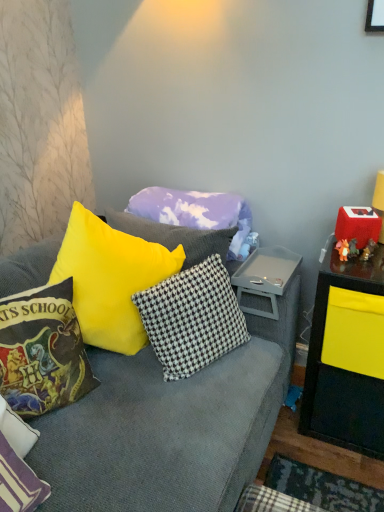
Find the location of `cloud-patterned fabric pillow at center, the 1th pillow from the back`. cloud-patterned fabric pillow at center, the 1th pillow from the back is located at coordinates (195, 211).

Is white and brown checkered pillow at center, the second pillow when ordered from back to front, bigger than white textured pillow at lower left, the 4th pillow when ordered from back to front?

Yes, white and brown checkered pillow at center, the second pillow when ordered from back to front, is bigger than white textured pillow at lower left, the 4th pillow when ordered from back to front.

Is white and brown checkered pillow at center, which is the 3th pillow in front-to-back order, far away from white textured pillow at lower left, which appears as the 1th pillow when viewed from the front?

No, white and brown checkered pillow at center, which is the 3th pillow in front-to-back order, is in close proximity to white textured pillow at lower left, which appears as the 1th pillow when viewed from the front.

In the image, is white and brown checkered pillow at center, the second pillow when ordered from back to front, positioned in front of or behind white textured pillow at lower left, which appears as the 1th pillow when viewed from the front?

white and brown checkered pillow at center, the second pillow when ordered from back to front, is behind white textured pillow at lower left, which appears as the 1th pillow when viewed from the front.

Which object is positioned more to the right, white and brown checkered pillow at center, the second pillow when ordered from back to front, or white textured pillow at lower left, the 4th pillow when ordered from back to front?

white and brown checkered pillow at center, the second pillow when ordered from back to front, is more to the right.

Is cloud-patterned fabric pillow at center, the 1th pillow from the back, turned away from white and brown checkered pillow at center, the second pillow when ordered from back to front?

No, cloud-patterned fabric pillow at center, the 1th pillow from the back, is not facing away from white and brown checkered pillow at center, the second pillow when ordered from back to front.

Between cloud-patterned fabric pillow at center, the 1th pillow from the back, and white and brown checkered pillow at center, the second pillow when ordered from back to front, which one has smaller width?

white and brown checkered pillow at center, the second pillow when ordered from back to front, is thinner.

Is gray plastic tray at center not within velvet harry potter-themed pillow at left, which is the 3th pillow from back to front?

gray plastic tray at center lies outside velvet harry potter-themed pillow at left, which is the 3th pillow from back to front,'s area.

From the image's perspective, which is below, gray plastic tray at center or velvet harry potter-themed pillow at left, which is the 3th pillow from back to front?

velvet harry potter-themed pillow at left, which is the 3th pillow from back to front, appears lower in the image.

From a real-world perspective, between gray plastic tray at center and velvet harry potter-themed pillow at left, which is the 3th pillow from back to front, who is vertically lower?

gray plastic tray at center, from a real-world perspective.

Considering the sizes of objects gray plastic tray at center and velvet harry potter-themed pillow at left, which is the 3th pillow from back to front, in the image provided, who is bigger, gray plastic tray at center or velvet harry potter-themed pillow at left, which is the 3th pillow from back to front,?

With larger size is velvet harry potter-themed pillow at left, which is the 3th pillow from back to front.

How much distance is there between velvet harry potter-themed pillow at left, which is the 3th pillow from back to front, and cloud-patterned fabric pillow at center, placed as the fourth pillow when sorted from front to back?

The distance of velvet harry potter-themed pillow at left, which is the 3th pillow from back to front, from cloud-patterned fabric pillow at center, placed as the fourth pillow when sorted from front to back, is 26.30 inches.

Does point (19, 339) come in front of point (172, 208)?

Yes.

How different are the orientations of velvet harry potter-themed pillow at left, which is the 3th pillow from back to front, and cloud-patterned fabric pillow at center, placed as the fourth pillow when sorted from front to back, in degrees?

61.4 degrees separate the facing orientations of velvet harry potter-themed pillow at left, which is the 3th pillow from back to front, and cloud-patterned fabric pillow at center, placed as the fourth pillow when sorted from front to back.

Is cloud-patterned fabric pillow at center, the 1th pillow from the back, a part of velvet harry potter-themed pillow at left, which ranks as the 2th pillow in front-to-back order?

No.

Is cloud-patterned fabric pillow at center, the 1th pillow from the back, facing away from gray plastic tray at center?

No, cloud-patterned fabric pillow at center, the 1th pillow from the back, is not facing the opposite direction of gray plastic tray at center.

Based on the photo, how different are the orientations of cloud-patterned fabric pillow at center, the 1th pillow from the back, and gray plastic tray at center in degrees?

The facing directions of cloud-patterned fabric pillow at center, the 1th pillow from the back, and gray plastic tray at center are 0.000272 degrees apart.

Considering the relative positions of cloud-patterned fabric pillow at center, placed as the fourth pillow when sorted from front to back, and gray plastic tray at center in the image provided, is cloud-patterned fabric pillow at center, placed as the fourth pillow when sorted from front to back, to the left or to the right of gray plastic tray at center?

cloud-patterned fabric pillow at center, placed as the fourth pillow when sorted from front to back, is positioned on gray plastic tray at center's left side.

From a real-world perspective, does cloud-patterned fabric pillow at center, the 1th pillow from the back, stand above gray plastic tray at center?

Yes, from a real-world perspective, cloud-patterned fabric pillow at center, the 1th pillow from the back, is above gray plastic tray at center.

What's the angular difference between gray plastic tray at center and cloud-patterned fabric pillow at center, the 1th pillow from the back,'s facing directions?

gray plastic tray at center and cloud-patterned fabric pillow at center, the 1th pillow from the back, are facing 0.000272 degrees away from each other.

Could cloud-patterned fabric pillow at center, the 1th pillow from the back, be considered to be inside gray plastic tray at center?

No, cloud-patterned fabric pillow at center, the 1th pillow from the back, is not a part of gray plastic tray at center.

Which is less distant, (256, 260) or (174, 198)?

Point (256, 260).

Does gray plastic tray at center have a lesser height compared to cloud-patterned fabric pillow at center, placed as the fourth pillow when sorted from front to back?

Yes, gray plastic tray at center is shorter than cloud-patterned fabric pillow at center, placed as the fourth pillow when sorted from front to back.

From a real-world perspective, is velvet harry potter-themed pillow at left, which is the 3th pillow from back to front, located beneath white textured pillow at lower left, the 4th pillow when ordered from back to front?

Actually, velvet harry potter-themed pillow at left, which is the 3th pillow from back to front, is physically above white textured pillow at lower left, the 4th pillow when ordered from back to front, in the real world.

Between velvet harry potter-themed pillow at left, which is the 3th pillow from back to front, and white textured pillow at lower left, the 4th pillow when ordered from back to front, which one appears on the left side from the viewer's perspective?

white textured pillow at lower left, the 4th pillow when ordered from back to front, is more to the left.

Could you measure the distance between velvet harry potter-themed pillow at left, which is the 3th pillow from back to front, and white textured pillow at lower left, which appears as the 1th pillow when viewed from the front?

velvet harry potter-themed pillow at left, which is the 3th pillow from back to front, and white textured pillow at lower left, which appears as the 1th pillow when viewed from the front, are 11.87 inches apart.

From the image's perspective, which is above, velvet harry potter-themed pillow at left, which is the 3th pillow from back to front, or white textured pillow at lower left, the 4th pillow when ordered from back to front?

velvet harry potter-themed pillow at left, which is the 3th pillow from back to front, appears higher in the image.

Locate an element on the screen. Image resolution: width=384 pixels, height=512 pixels. the 2nd pillow above when counting from the white textured pillow at lower left, the 4th pillow when ordered from back to front (from the image's perspective) is located at coordinates (192, 318).

In order to click on pillow behind the white and brown checkered pillow at center, which is the 3th pillow in front-to-back order in this screenshot , I will do `click(195, 211)`.

Based on their spatial positions, is white textured pillow at lower left, the 4th pillow when ordered from back to front, or cloud-patterned fabric pillow at center, placed as the fourth pillow when sorted from front to back, further from white and brown checkered pillow at center, which is the 3th pillow in front-to-back order?

Among the two, white textured pillow at lower left, the 4th pillow when ordered from back to front, is located further to white and brown checkered pillow at center, which is the 3th pillow in front-to-back order.

Estimate the real-world distances between objects in this image. Which object is further from cloud-patterned fabric pillow at center, placed as the fourth pillow when sorted from front to back, gray plastic tray at center or white and brown checkered pillow at center, the second pillow when ordered from back to front?

white and brown checkered pillow at center, the second pillow when ordered from back to front, lies further to cloud-patterned fabric pillow at center, placed as the fourth pillow when sorted from front to back, than the other object.

When comparing their distances from white and brown checkered pillow at center, which is the 3th pillow in front-to-back order, does cloud-patterned fabric pillow at center, the 1th pillow from the back, or gray plastic tray at center seem further?

The object further to white and brown checkered pillow at center, which is the 3th pillow in front-to-back order, is cloud-patterned fabric pillow at center, the 1th pillow from the back.

Based on their spatial positions, is cloud-patterned fabric pillow at center, placed as the fourth pillow when sorted from front to back, or white textured pillow at lower left, which appears as the 1th pillow when viewed from the front, closer to white and brown checkered pillow at center, the second pillow when ordered from back to front?

cloud-patterned fabric pillow at center, placed as the fourth pillow when sorted from front to back, lies closer to white and brown checkered pillow at center, the second pillow when ordered from back to front, than the other object.

Which object lies further to the anchor point velvet harry potter-themed pillow at left, which is the 3th pillow from back to front, white textured pillow at lower left, the 4th pillow when ordered from back to front, or cloud-patterned fabric pillow at center, the 1th pillow from the back?

cloud-patterned fabric pillow at center, the 1th pillow from the back.

From the image, which object appears to be farther from white textured pillow at lower left, which appears as the 1th pillow when viewed from the front, gray plastic tray at center or white and brown checkered pillow at center, which is the 3th pillow in front-to-back order?

Among the two, gray plastic tray at center is located further to white textured pillow at lower left, which appears as the 1th pillow when viewed from the front.

Which object lies further to the anchor point gray plastic tray at center, velvet harry potter-themed pillow at left, which ranks as the 2th pillow in front-to-back order, or cloud-patterned fabric pillow at center, the 1th pillow from the back?

velvet harry potter-themed pillow at left, which ranks as the 2th pillow in front-to-back order, is positioned further to the anchor gray plastic tray at center.

Based on their spatial positions, is cloud-patterned fabric pillow at center, the 1th pillow from the back, or white textured pillow at lower left, which appears as the 1th pillow when viewed from the front, further from velvet harry potter-themed pillow at left, which ranks as the 2th pillow in front-to-back order?

Based on the image, cloud-patterned fabric pillow at center, the 1th pillow from the back, appears to be further to velvet harry potter-themed pillow at left, which ranks as the 2th pillow in front-to-back order.

Identify the location of pillow situated between velvet harry potter-themed pillow at left, which ranks as the 2th pillow in front-to-back order, and white and brown checkered pillow at center, the second pillow when ordered from back to front, from left to right. (195, 211).

I want to click on side table between cloud-patterned fabric pillow at center, the 1th pillow from the back, and white and brown checkered pillow at center, which is the 3th pillow in front-to-back order, in the vertical direction, so click(265, 277).